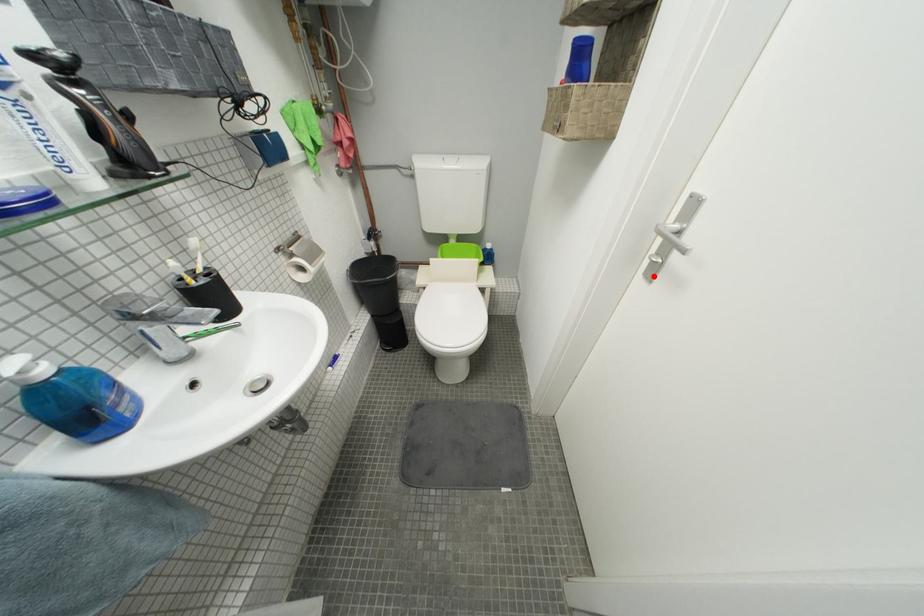
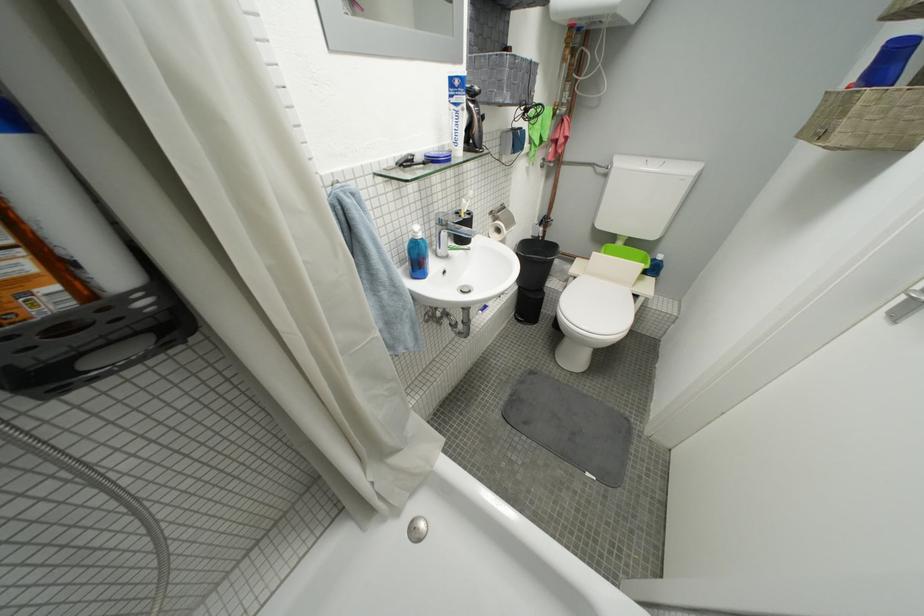
Question: I am providing you with two images of the same scene from different viewpoints. A red point is shown in image1. For the corresponding object point in image2, is it positioned nearer or farther from the camera?

Choices:
 (A) Nearer
 (B) Farther

Answer: (B)